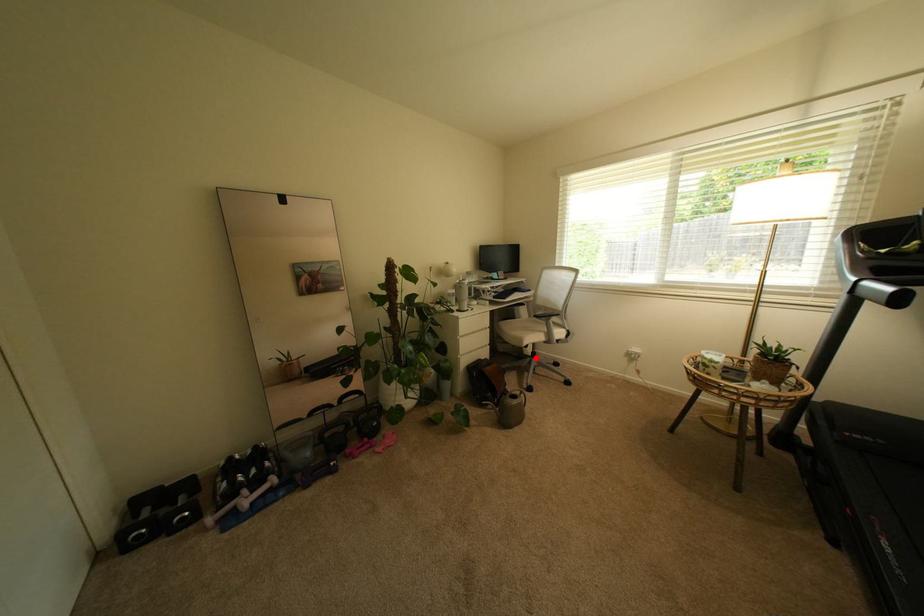
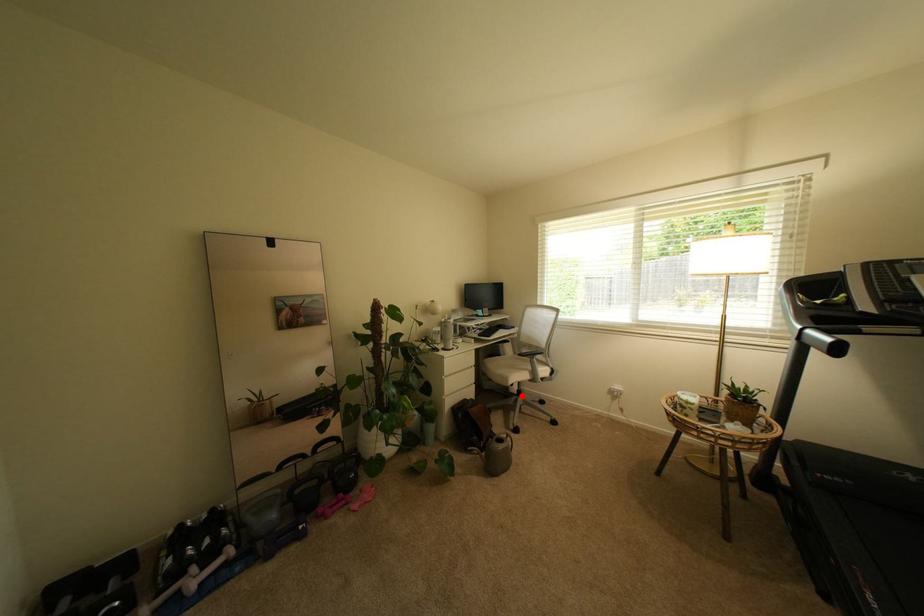
I am providing you with two images of the same scene from different viewpoints. A red point is marked on the first image and another point is marked on the second image. Do the highlighted points in image1 and image2 indicate the same real-world spot?

Yes